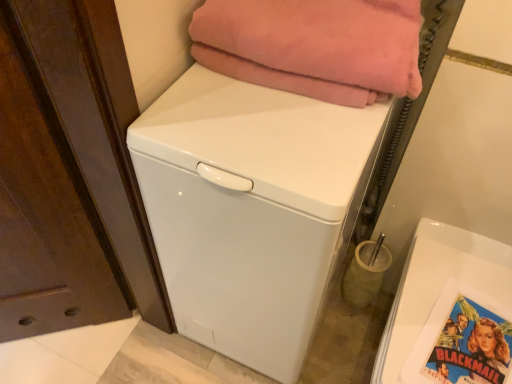
Question: Is white glossy washing machine at center taller than pink fleece blanket at upper center?

Choices:
 (A) no
 (B) yes

Answer: (B)

Question: Is white glossy washing machine at center thinner than pink fleece blanket at upper center?

Choices:
 (A) no
 (B) yes

Answer: (A)

Question: Considering the relative sizes of white glossy washing machine at center and pink fleece blanket at upper center in the image provided, is white glossy washing machine at center smaller than pink fleece blanket at upper center?

Choices:
 (A) no
 (B) yes

Answer: (A)

Question: Considering the relative sizes of white glossy washing machine at center and pink fleece blanket at upper center in the image provided, is white glossy washing machine at center bigger than pink fleece blanket at upper center?

Choices:
 (A) no
 (B) yes

Answer: (B)

Question: Is pink fleece blanket at upper center at the back of white glossy washing machine at center?

Choices:
 (A) yes
 (B) no

Answer: (B)

Question: In terms of width, does pink fleece blanket at upper center look wider or thinner when compared to blue glossy comic book at lower right?

Choices:
 (A) wide
 (B) thin

Answer: (A)

Question: Is point (414, 16) closer or farther from the camera than point (507, 322)?

Choices:
 (A) farther
 (B) closer

Answer: (B)

Question: Is pink fleece blanket at upper center to the left or to the right of blue glossy comic book at lower right in the image?

Choices:
 (A) right
 (B) left

Answer: (B)

Question: Looking at the image, does pink fleece blanket at upper center seem bigger or smaller compared to blue glossy comic book at lower right?

Choices:
 (A) big
 (B) small

Answer: (A)

Question: Relative to white glossy washing machine at center, is pink fleece blanket at upper center in front or behind?

Choices:
 (A) front
 (B) behind

Answer: (B)

Question: Would you say pink fleece blanket at upper center is to the left or to the right of white glossy washing machine at center in the picture?

Choices:
 (A) right
 (B) left

Answer: (A)

Question: Considering the positions of pink fleece blanket at upper center and white glossy washing machine at center in the image, is pink fleece blanket at upper center taller or shorter than white glossy washing machine at center?

Choices:
 (A) short
 (B) tall

Answer: (A)

Question: Does point (374, 21) appear closer or farther from the camera than point (295, 309)?

Choices:
 (A) closer
 (B) farther

Answer: (A)

Question: Is white glossy washing machine at center situated inside blue glossy comic book at lower right or outside?

Choices:
 (A) outside
 (B) inside

Answer: (A)

Question: Is white glossy washing machine at center bigger or smaller than blue glossy comic book at lower right?

Choices:
 (A) big
 (B) small

Answer: (A)